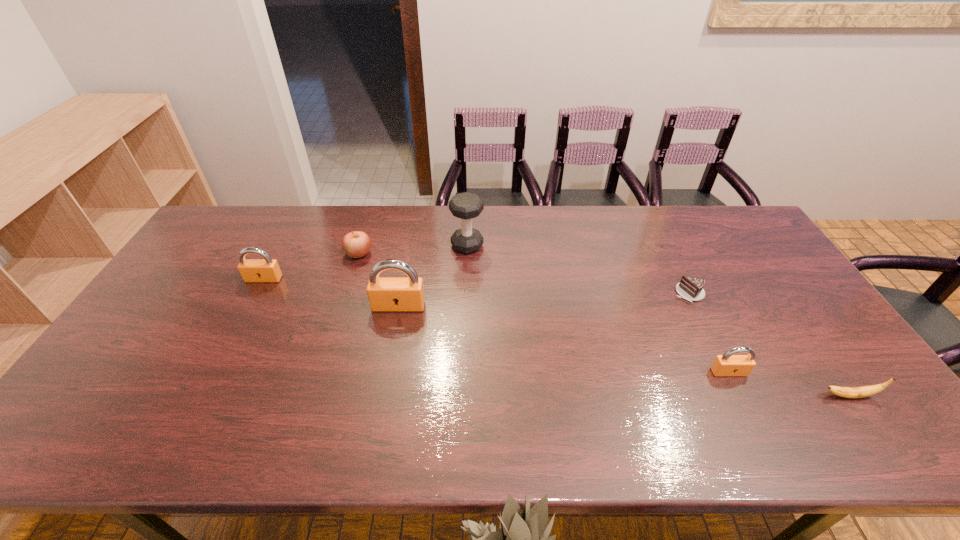
Where is `blank region between the apple and the fourth object from left to right`? The height and width of the screenshot is (540, 960). blank region between the apple and the fourth object from left to right is located at coordinates (413, 250).

The image size is (960, 540). In order to click on vacant region between the nearest padlock and the leftmost padlock in this screenshot , I will do [496, 326].

Identify the location of empty location between the rightmost padlock and the chocolate cake. (708, 333).

The width and height of the screenshot is (960, 540). Identify the location of free point between the chocolate cake and the second farthest padlock. tap(543, 300).

Identify the location of free area in between the dumbbell and the nearest padlock. (598, 309).

Identify the location of empty space between the fourth object from left to right and the third object from left to right. (433, 275).

This screenshot has width=960, height=540. What are the coordinates of `free space between the shortest object and the second tallest padlock` in the screenshot? It's located at (476, 286).

This screenshot has height=540, width=960. In order to click on vacant space that is in between the shortest padlock and the shortest object in this screenshot , I will do `click(708, 333)`.

Identify the location of free spot between the shortest object and the shortest padlock. This screenshot has width=960, height=540. (708, 333).

Point out which object is positioned as the fifth nearest to the banana. Please provide its 2D coordinates. Your answer should be formatted as a tuple, i.e. [(x, y)], where the tuple contains the x and y coordinates of a point satisfying the conditions above.

[(356, 244)]